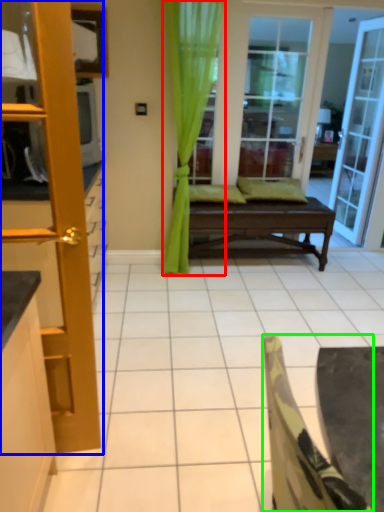
Question: Estimate the real-world distances between objects in this image. Which object is farther from curtain (highlighted by a red box), door (highlighted by a blue box) or chair (highlighted by a green box)?

Choices:
 (A) door
 (B) chair

Answer: (B)